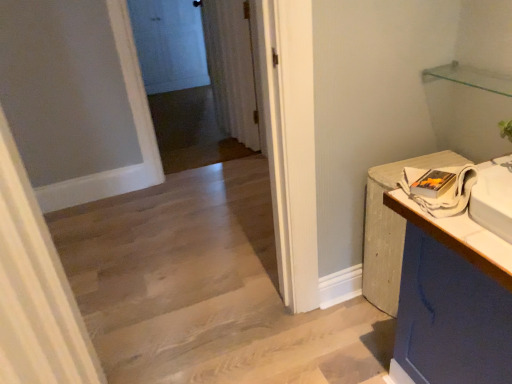
Question: Considering the positions of white wood counter at right and white sheer curtain at center, the 2th curtain from the bottom, in the image, is white wood counter at right wider or thinner than white sheer curtain at center, the 2th curtain from the bottom,?

Choices:
 (A) wide
 (B) thin

Answer: (A)

Question: In the image, is white wood counter at right positioned in front of or behind white sheer curtain at center, positioned as the first curtain in top-to-bottom order?

Choices:
 (A) behind
 (B) front

Answer: (B)

Question: Which object is the farthest from the white sheer curtain at center, the 1th curtain viewed from the back?

Choices:
 (A) white textured curtain at left, the first curtain when ordered from front to back
 (B) white glossy door at upper center
 (C) white wood counter at right

Answer: (B)

Question: Which is nearer to the white glossy door at upper center?

Choices:
 (A) white textured curtain at left, acting as the second curtain starting from the top
 (B) white sheer curtain at center, positioned as the first curtain in top-to-bottom order
 (C) white wood counter at right

Answer: (B)